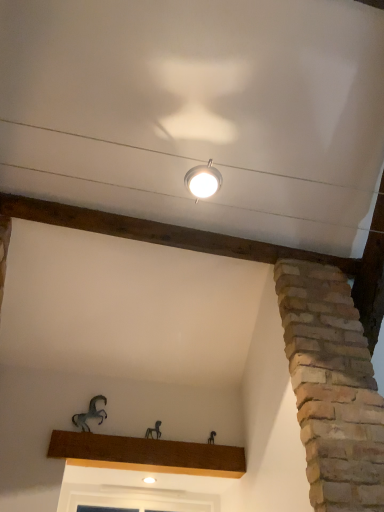
Image resolution: width=384 pixels, height=512 pixels. What do you see at coordinates (154, 430) in the screenshot? I see `metallic horse at center, positioned as the second animal in top-to-bottom order` at bounding box center [154, 430].

What do you see at coordinates (203, 180) in the screenshot?
I see `matte silver lamp at upper center` at bounding box center [203, 180].

The image size is (384, 512). I want to click on brown wood at center, so click(147, 454).

Is matte silver lamp at upper center next to brown wood at center and touching it?

No, matte silver lamp at upper center is not in contact with brown wood at center.

Is matte silver lamp at upper center thinner than brown wood at center?

No, matte silver lamp at upper center is not thinner than brown wood at center.

From a real-world perspective, which object rests below the other?

brown wood at center.

The width and height of the screenshot is (384, 512). What are the coordinates of `lamp located above the brown wood at center (from a real-world perspective)` in the screenshot? It's located at (203, 180).

Which is in front, metallic horse at center, the 1th animal in the right-to-left sequence, or matte silver lamp at upper center?

matte silver lamp at upper center is in front.

Could you measure the distance between metallic horse at center, the 1th animal in the right-to-left sequence, and matte silver lamp at upper center?

metallic horse at center, the 1th animal in the right-to-left sequence, and matte silver lamp at upper center are 4.23 feet apart.

From the picture: Is metallic horse at center, which appears as the 2th animal when viewed from the left, positioned with its back to matte silver lamp at upper center?

No, metallic horse at center, which appears as the 2th animal when viewed from the left, is not facing away from matte silver lamp at upper center.

Considering the relative sizes of metallic horse at center, positioned as the second animal in top-to-bottom order, and matte silver lamp at upper center in the image provided, is metallic horse at center, positioned as the second animal in top-to-bottom order, thinner than matte silver lamp at upper center?

Yes.

Is matte silver lamp at upper center looking in the opposite direction of metallic horse at lower left, which is the first animal from left to right?

No, matte silver lamp at upper center is not facing away from metallic horse at lower left, which is the first animal from left to right.

What's the angular difference between matte silver lamp at upper center and metallic horse at lower left, placed as the second animal when sorted from bottom to top,'s facing directions?

The angular difference between matte silver lamp at upper center and metallic horse at lower left, placed as the second animal when sorted from bottom to top, is 89.4 degrees.

You are a GUI agent. You are given a task and a screenshot of the screen. Output one action in this format:
    pyautogui.click(x=<x>, y=<y>)
    Task: Click on the lamp in front of the metallic horse at lower left, which is the first animal from left to right
    
    Given the screenshot: What is the action you would take?
    pyautogui.click(x=203, y=180)

Is the position of matte silver lamp at upper center less distant than that of metallic horse at lower left, acting as the first animal starting from the top?

Yes, it is.

Is metallic horse at lower left, acting as the first animal starting from the top, not inside metallic horse at center, positioned as the second animal in top-to-bottom order?

metallic horse at lower left, acting as the first animal starting from the top, lies outside metallic horse at center, positioned as the second animal in top-to-bottom order,'s area.

In the scene shown: From the image's perspective, is metallic horse at lower left, which is the first animal from left to right, above metallic horse at center, positioned as the second animal in top-to-bottom order?

Indeed, from the image's perspective, metallic horse at lower left, which is the first animal from left to right, is shown above metallic horse at center, positioned as the second animal in top-to-bottom order.

Could you tell me if metallic horse at lower left, which is the first animal from left to right, is turned towards metallic horse at center, arranged as the first animal when ordered from the bottom?

No.

How far apart are metallic horse at center, the 1th animal in the right-to-left sequence, and metallic horse at lower left, which is the first animal from left to right?

A distance of 11.81 inches exists between metallic horse at center, the 1th animal in the right-to-left sequence, and metallic horse at lower left, which is the first animal from left to right.

From a real-world perspective, is metallic horse at center, arranged as the first animal when ordered from the bottom, positioned over metallic horse at lower left, placed as the second animal when sorted from bottom to top, based on gravity?

Incorrect, from a real-world perspective, metallic horse at center, arranged as the first animal when ordered from the bottom, is lower than metallic horse at lower left, placed as the second animal when sorted from bottom to top.

Based on the photo, from the image's perspective, between metallic horse at center, arranged as the first animal when ordered from the bottom, and metallic horse at lower left, marked as the second animal in a right-to-left arrangement, which one is located above?

From the image's view, metallic horse at lower left, marked as the second animal in a right-to-left arrangement, is above.

Is metallic horse at center, which appears as the 2th animal when viewed from the left, aimed at metallic horse at lower left, marked as the second animal in a right-to-left arrangement?

No, metallic horse at center, which appears as the 2th animal when viewed from the left, is not turned towards metallic horse at lower left, marked as the second animal in a right-to-left arrangement.

Image resolution: width=384 pixels, height=512 pixels. I want to click on the 1st animal located above the brown wood at center (from a real-world perspective), so click(154, 430).

Is metallic horse at center, which appears as the 2th animal when viewed from the left, at the back of brown wood at center?

→ That's not correct — brown wood at center is not looking away from metallic horse at center, which appears as the 2th animal when viewed from the left.

From a real-world perspective, who is located lower, brown wood at center or metallic horse at center, positioned as the second animal in top-to-bottom order?

brown wood at center is physically lower.

Which is in front, point (191, 472) or point (148, 433)?

Point (191, 472)

Can you confirm if matte silver lamp at upper center is taller than metallic horse at center, arranged as the first animal when ordered from the bottom?

In fact, matte silver lamp at upper center may be shorter than metallic horse at center, arranged as the first animal when ordered from the bottom.

Could you tell me if matte silver lamp at upper center is turned towards metallic horse at center, positioned as the second animal in top-to-bottom order?

No, matte silver lamp at upper center is not oriented towards metallic horse at center, positioned as the second animal in top-to-bottom order.

Is point (221, 184) positioned after point (158, 434)?

No, it is not.

Where is `lamp that appears above the metallic horse at center, arranged as the first animal when ordered from the bottom (from a real-world perspective)`? This screenshot has width=384, height=512. lamp that appears above the metallic horse at center, arranged as the first animal when ordered from the bottom (from a real-world perspective) is located at coordinates (203, 180).

The width and height of the screenshot is (384, 512). Identify the location of window sill lying below the matte silver lamp at upper center (from the image's perspective). (147, 454).

The height and width of the screenshot is (512, 384). Identify the location of lamp that is above the metallic horse at center, arranged as the first animal when ordered from the bottom (from a real-world perspective). (203, 180).

Which object lies nearer to the anchor point brown wood at center, matte silver lamp at upper center or metallic horse at lower left, which is the first animal from left to right?

metallic horse at lower left, which is the first animal from left to right, is closer to brown wood at center.

Which object lies further to the anchor point metallic horse at center, the 1th animal in the right-to-left sequence, matte silver lamp at upper center or brown wood at center?

matte silver lamp at upper center.

Based on their spatial positions, is metallic horse at center, arranged as the first animal when ordered from the bottom, or brown wood at center further from matte silver lamp at upper center?

Based on the image, brown wood at center appears to be further to matte silver lamp at upper center.

Based on their spatial positions, is metallic horse at center, which appears as the 2th animal when viewed from the left, or matte silver lamp at upper center closer to brown wood at center?

metallic horse at center, which appears as the 2th animal when viewed from the left, lies closer to brown wood at center than the other object.

Which object lies further to the anchor point metallic horse at lower left, placed as the second animal when sorted from bottom to top, metallic horse at center, the 1th animal in the right-to-left sequence, or brown wood at center?

The object further to metallic horse at lower left, placed as the second animal when sorted from bottom to top, is metallic horse at center, the 1th animal in the right-to-left sequence.

Based on their spatial positions, is metallic horse at lower left, marked as the second animal in a right-to-left arrangement, or matte silver lamp at upper center further from metallic horse at center, which appears as the 2th animal when viewed from the left?

matte silver lamp at upper center is positioned further to the anchor metallic horse at center, which appears as the 2th animal when viewed from the left.

Considering their positions, is brown wood at center positioned closer to matte silver lamp at upper center than metallic horse at center, arranged as the first animal when ordered from the bottom?

Among the two, metallic horse at center, arranged as the first animal when ordered from the bottom, is located nearer to matte silver lamp at upper center.

Considering their positions, is matte silver lamp at upper center positioned closer to brown wood at center than metallic horse at center, the 1th animal in the right-to-left sequence?

Based on the image, metallic horse at center, the 1th animal in the right-to-left sequence, appears to be nearer to brown wood at center.

The height and width of the screenshot is (512, 384). I want to click on animal between matte silver lamp at upper center and metallic horse at center, which appears as the 2th animal when viewed from the left, in the up-down direction, so click(90, 414).

At what (x,y) coordinates should I click in order to perform the action: click on window sill located between metallic horse at lower left, placed as the second animal when sorted from bottom to top, and metallic horse at center, the 1th animal in the right-to-left sequence, in the left-right direction. Please return your answer as a coordinate pair (x, y). This screenshot has height=512, width=384. Looking at the image, I should click on (147, 454).